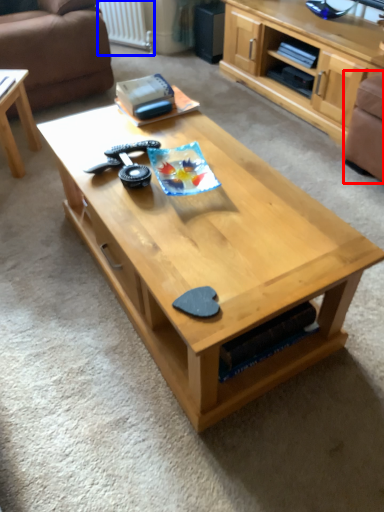
Question: Which of the following is the closest to the observer, armchair (highlighted by a red box) or radiator (highlighted by a blue box)?

Choices:
 (A) armchair
 (B) radiator

Answer: (A)